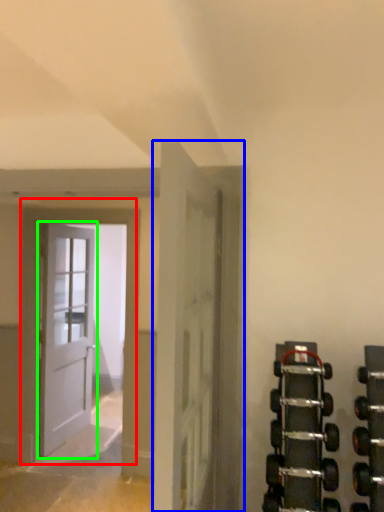
Question: Which object is the farthest from door (highlighted by a red box)? Choose among these: door (highlighted by a blue box) or door (highlighted by a green box).

Choices:
 (A) door
 (B) door

Answer: (A)